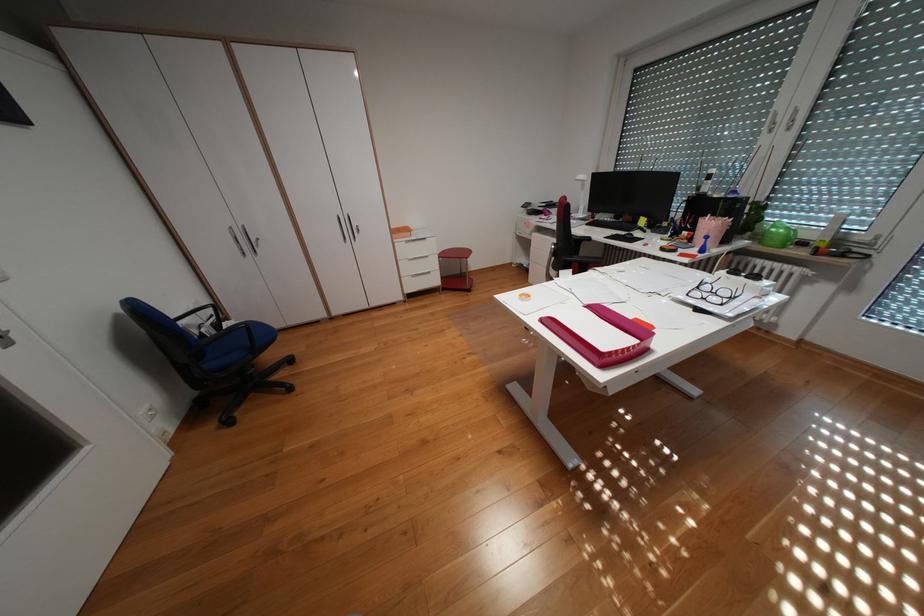
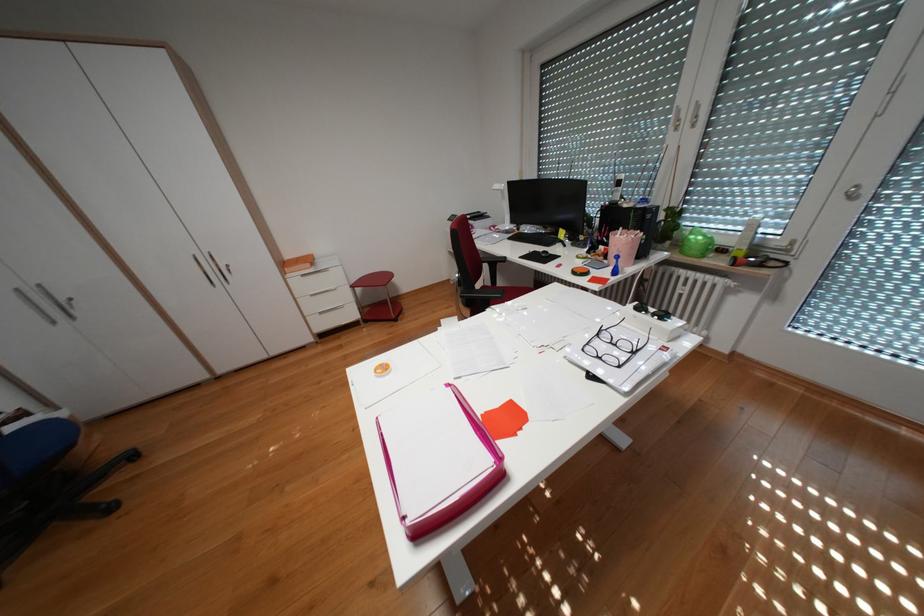
In the second image, find the point that corresponds to pixel 777 114 in the first image.

(682, 111)